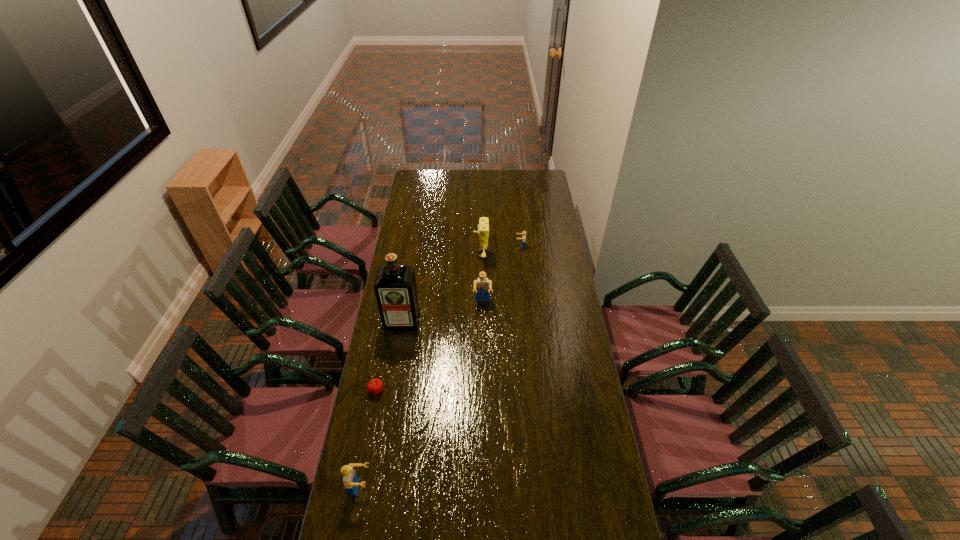
Where is `free space located 0.150m on the face of the third shortest object`? free space located 0.150m on the face of the third shortest object is located at coordinates (416, 487).

Identify the location of vacant space situated 0.150m on the face of the second Lego from left to right. This screenshot has height=540, width=960. (483, 335).

Identify the location of vacant region located on the face of the shortest Lego. (479, 246).

At what (x,y) coordinates should I click in order to perform the action: click on vacant space located on the face of the shortest Lego. Please return your answer as a coordinate pair (x, y). This screenshot has height=540, width=960. Looking at the image, I should click on (503, 246).

Find the location of `vacant position located 0.190m on the face of the shortest Lego`. vacant position located 0.190m on the face of the shortest Lego is located at coordinates (481, 246).

Locate an element on the screen. The image size is (960, 540). blank space located on the face of the fifth shortest object is located at coordinates (434, 255).

Identify the location of blank area located on the face of the fifth shortest object. (457, 255).

Image resolution: width=960 pixels, height=540 pixels. I want to click on vacant space situated on the face of the fifth shortest object, so click(433, 255).

The image size is (960, 540). Find the location of `free space located 0.260m on the front label of the third nearest object`. free space located 0.260m on the front label of the third nearest object is located at coordinates (393, 380).

Locate an element on the screen. blank area located 0.060m on the right of the cherry is located at coordinates (398, 390).